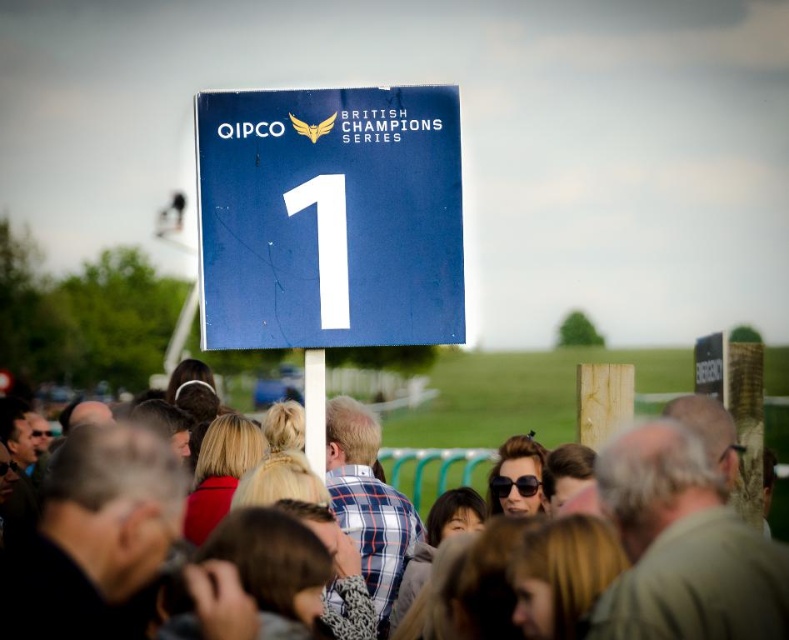
You are a photographer at the horse racing event and want to capture both the blue matte sign at center and the white plastic pole at center in a single frame. Based on their positions, which object should you position on the left side of your camera viewfinder to include both?

The white plastic pole at center should be positioned on the left side of your camera viewfinder because the blue matte sign at center is to the right of it, ensuring both objects are included in the frame.

You are a photographer standing at the starting line of the horse race. You want to take a photo of the matte blue sign at upper center and ensure that the crowd in the foreground is also visible. Given the distance between them, will you be able to capture both in a single frame without moving your position?

The matte blue sign at upper center and the crowd in the foreground are 89.64 meters apart. Since the photographer is at the starting line, they can likely capture both in a single frame as the distance between them allows for a wide enough angle to include both the sign and the crowd without needing to move.